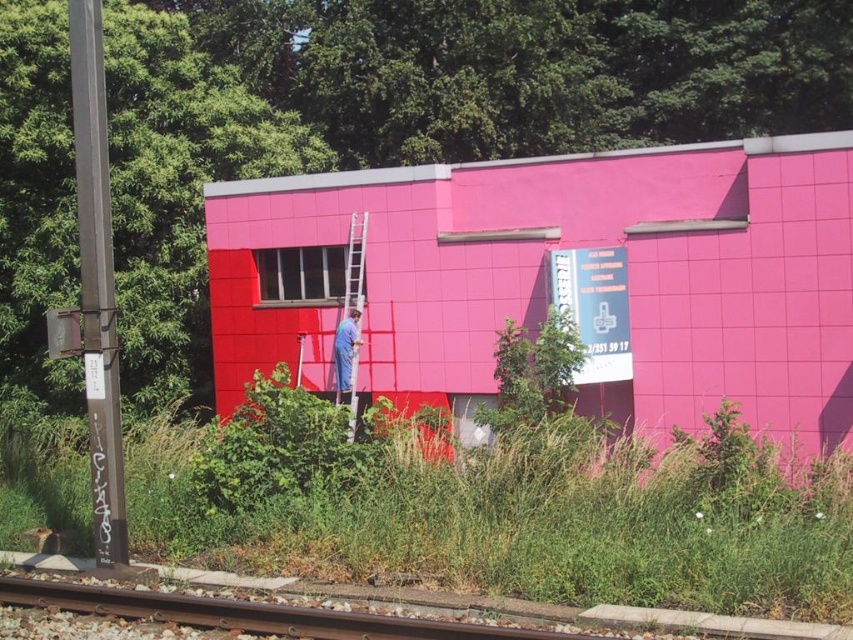
In the scene shown: Can you confirm if metallic pole at left is positioned above metallic silver ladder at center?

No, metallic pole at left is not above metallic silver ladder at center.

Which is more to the right, metallic pole at left or metallic silver ladder at center?

From the viewer's perspective, metallic silver ladder at center appears more on the right side.

Does point (93, 74) come farther from viewer compared to point (358, 220)?

No, (93, 74) is in front of (358, 220).

Identify the location of metallic pole at left. This screenshot has width=853, height=640. (97, 282).

Can you confirm if metallic silver ladder at center is smaller than blue fabric man at center?

Indeed, metallic silver ladder at center has a smaller size compared to blue fabric man at center.

Looking at this image, can you confirm if metallic silver ladder at center is positioned above blue fabric man at center?

Yes, metallic silver ladder at center is above blue fabric man at center.

Is point (354, 369) positioned before point (354, 342)?

Yes, point (354, 369) is closer to viewer.

Find the location of a particular element. metallic silver ladder at center is located at coordinates (355, 266).

Identify the location of metallic pole at left. Image resolution: width=853 pixels, height=640 pixels. (97, 282).

Which is more to the left, metallic pole at left or blue fabric man at center?

metallic pole at left

Is point (103, 451) less distant than point (361, 340)?

Yes, it is in front of point (361, 340).

At what (x,y) coordinates should I click in order to perform the action: click on metallic pole at left. Please return your answer as a coordinate pair (x, y). Looking at the image, I should click on (97, 282).